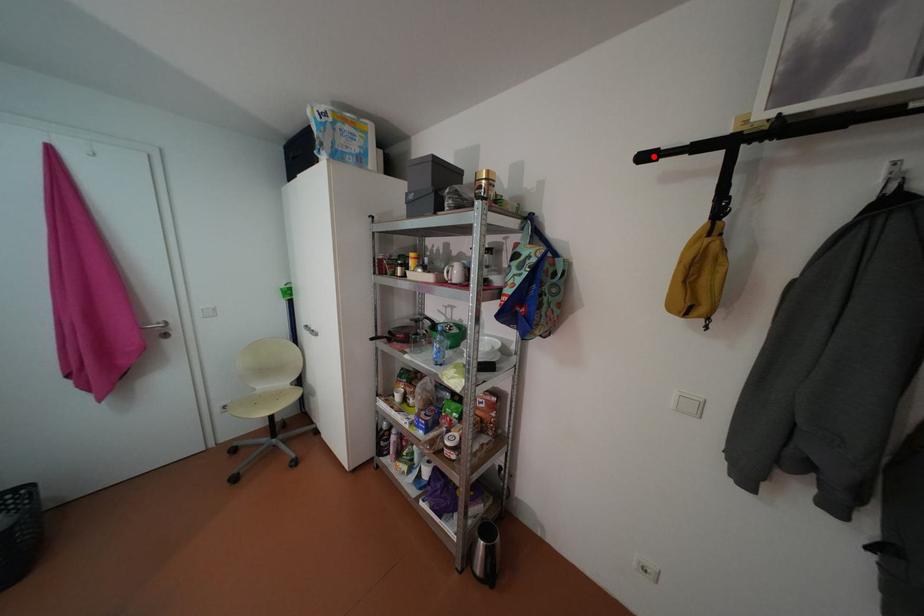
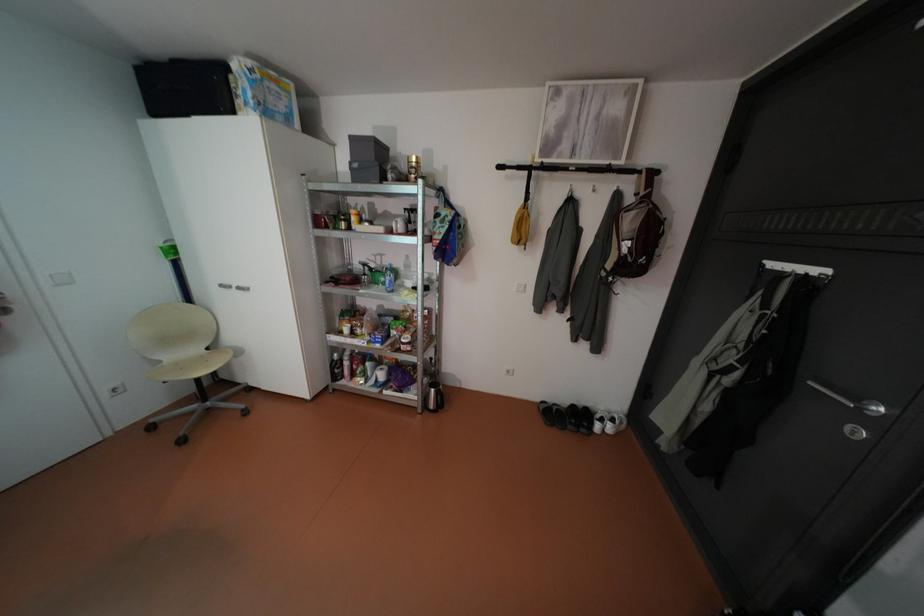
Where in the second image is the point corresponding to the highlighted location from the first image?

(508, 166)